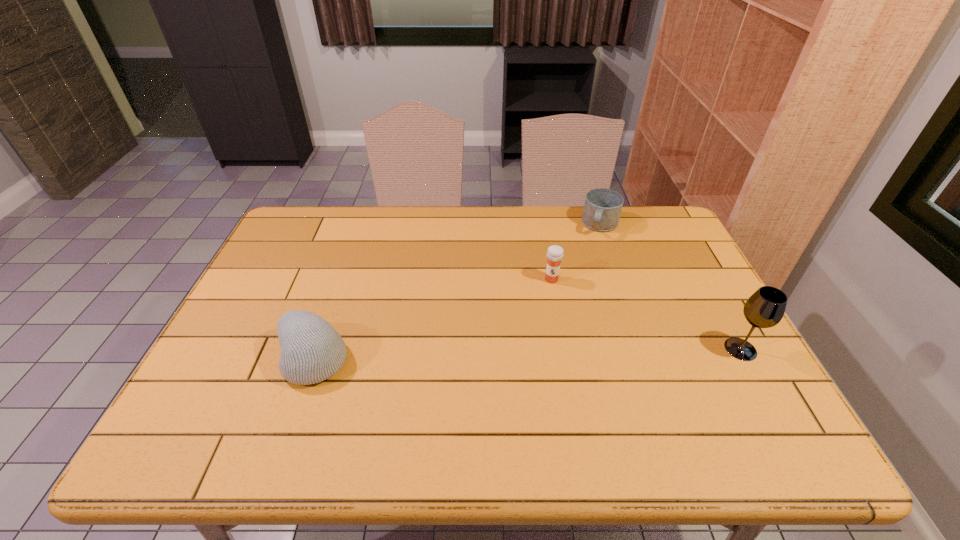
The height and width of the screenshot is (540, 960). Find the location of `empty location between the tallest object and the beanie`. empty location between the tallest object and the beanie is located at coordinates (527, 354).

I want to click on free space between the rightmost object and the third object from left to right, so click(671, 287).

Where is `free space between the medicine and the mug`? The width and height of the screenshot is (960, 540). free space between the medicine and the mug is located at coordinates (576, 252).

What are the coordinates of `object that is the closest to the medicine` in the screenshot? It's located at (602, 208).

Choose which object is the third nearest neighbor to the second object from left to right. Please provide its 2D coordinates. Your answer should be formatted as a tuple, i.e. [(x, y)], where the tuple contains the x and y coordinates of a point satisfying the conditions above.

[(312, 351)]

Locate an element on the screen. This screenshot has height=540, width=960. vacant position in the image that satisfies the following two spatial constraints: 1. on the back side of the leftmost object; 2. on the right side of the mug is located at coordinates (360, 225).

Where is `free location that satisfies the following two spatial constraints: 1. on the back side of the leftmost object; 2. on the right side of the tallest object`? free location that satisfies the following two spatial constraints: 1. on the back side of the leftmost object; 2. on the right side of the tallest object is located at coordinates (317, 349).

You are a GUI agent. You are given a task and a screenshot of the screen. Output one action in this format:
    pyautogui.click(x=<x>, y=<y>)
    Task: Click on the free space that satisfies the following two spatial constraints: 1. on the back side of the farthest object; 2. on the left side of the leftmost object
    
    Given the screenshot: What is the action you would take?
    pyautogui.click(x=360, y=225)

Where is `vacant area in the image that satisfies the following two spatial constraints: 1. on the back side of the second object from right to left; 2. on the left side of the second object from left to right`? vacant area in the image that satisfies the following two spatial constraints: 1. on the back side of the second object from right to left; 2. on the left side of the second object from left to right is located at coordinates (541, 225).

Locate an element on the screen. vacant region that satisfies the following two spatial constraints: 1. on the back side of the wineglass; 2. on the right side of the beanie is located at coordinates [x=317, y=349].